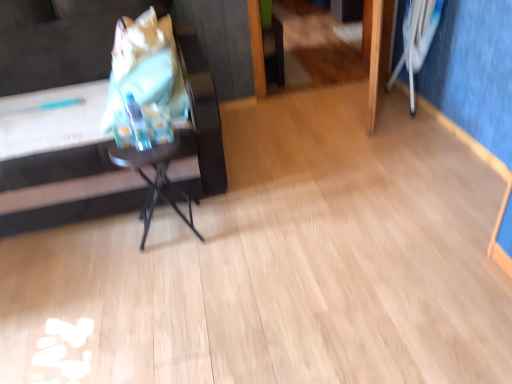
The width and height of the screenshot is (512, 384). What are the coordinates of `vacant space that is to the left of white fabric swivel chair at upper right` in the screenshot? It's located at (365, 104).